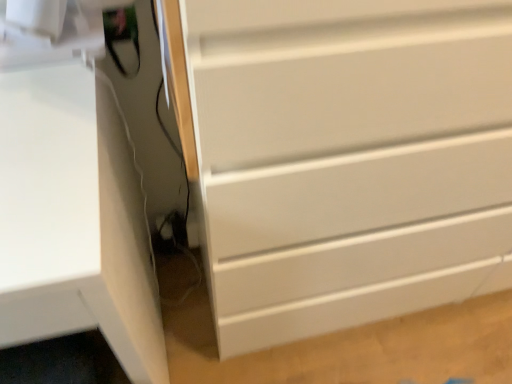
Question: Is white matte computer desk at left positioned in front of white matte chest of drawers at center?

Choices:
 (A) no
 (B) yes

Answer: (B)

Question: Does white matte computer desk at left have a greater width compared to white matte chest of drawers at center?

Choices:
 (A) no
 (B) yes

Answer: (B)

Question: From a real-world perspective, is white matte computer desk at left physically below white matte chest of drawers at center?

Choices:
 (A) no
 (B) yes

Answer: (B)

Question: From a real-world perspective, is white matte computer desk at left positioned over white matte chest of drawers at center based on gravity?

Choices:
 (A) no
 (B) yes

Answer: (A)

Question: Does white matte computer desk at left have a larger size compared to white matte chest of drawers at center?

Choices:
 (A) yes
 (B) no

Answer: (B)

Question: Can you confirm if white matte computer desk at left is taller than white matte chest of drawers at center?

Choices:
 (A) no
 (B) yes

Answer: (A)

Question: Does white matte chest of drawers at center have a larger size compared to white matte computer desk at left?

Choices:
 (A) yes
 (B) no

Answer: (A)

Question: Considering the relative sizes of white matte chest of drawers at center and white matte computer desk at left in the image provided, is white matte chest of drawers at center smaller than white matte computer desk at left?

Choices:
 (A) no
 (B) yes

Answer: (A)

Question: From the image's perspective, is white matte chest of drawers at center above white matte computer desk at left?

Choices:
 (A) no
 (B) yes

Answer: (B)

Question: Is white matte chest of drawers at center directly adjacent to white matte computer desk at left?

Choices:
 (A) yes
 (B) no

Answer: (B)

Question: Is white matte computer desk at left surrounded by white matte chest of drawers at center?

Choices:
 (A) no
 (B) yes

Answer: (A)

Question: Can you confirm if white matte chest of drawers at center is taller than white matte computer desk at left?

Choices:
 (A) no
 (B) yes

Answer: (B)

Question: Is point (105, 236) closer or farther from the camera than point (359, 213)?

Choices:
 (A) farther
 (B) closer

Answer: (B)